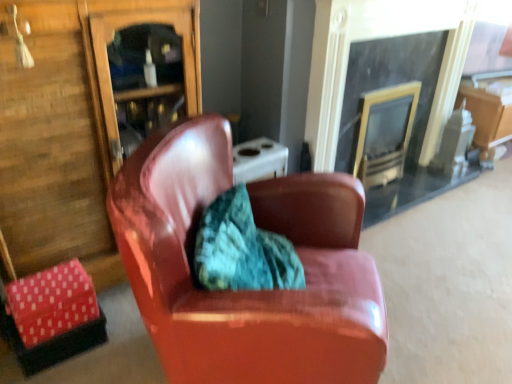
Question: Relative to shiny leather armchair at center, is black glass fireplace at upper right in front or behind?

Choices:
 (A) behind
 (B) front

Answer: (A)

Question: From a real-world perspective, relative to shiny leather armchair at center, is black glass fireplace at upper right vertically above or below?

Choices:
 (A) above
 (B) below

Answer: (A)

Question: Is black glass fireplace at upper right bigger or smaller than shiny leather armchair at center?

Choices:
 (A) big
 (B) small

Answer: (B)

Question: In the image, is shiny leather armchair at center on the left side or the right side of black glass fireplace at upper right?

Choices:
 (A) left
 (B) right

Answer: (A)

Question: Considering their positions, is shiny leather armchair at center located in front of or behind black glass fireplace at upper right?

Choices:
 (A) behind
 (B) front

Answer: (B)

Question: Considering the positions of shiny leather armchair at center and black glass fireplace at upper right in the image, is shiny leather armchair at center taller or shorter than black glass fireplace at upper right?

Choices:
 (A) tall
 (B) short

Answer: (B)

Question: From the image's perspective, relative to black glass fireplace at upper right, is shiny leather armchair at center above or below?

Choices:
 (A) below
 (B) above

Answer: (A)